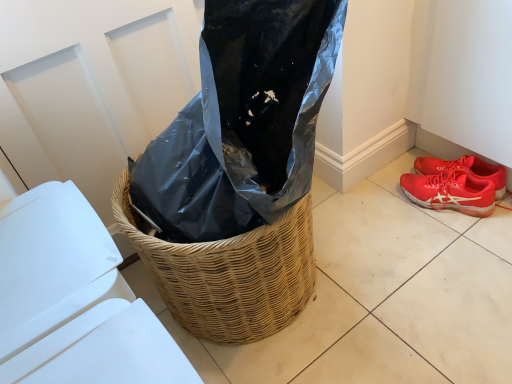
Question: Is shiny red sneakers at lower right, acting as the 2th footwear starting from the top, in front of or behind red mesh shoe at lower right, which is the 1th footwear in top-to-bottom order, in the image?

Choices:
 (A) behind
 (B) front

Answer: (B)

Question: Is shiny red sneakers at lower right, acting as the 2th footwear starting from the top, spatially inside red mesh shoe at lower right, the 2th footwear positioned from the bottom, or outside of it?

Choices:
 (A) outside
 (B) inside

Answer: (A)

Question: Which object is the closest to the white plastic lid at lower left?

Choices:
 (A) red mesh shoe at lower right, which is the 1th footwear in top-to-bottom order
 (B) shiny red sneakers at lower right, acting as the 2th footwear starting from the top

Answer: (B)

Question: Considering the real-world distances, which object is farthest from the red mesh shoe at lower right, the 2th footwear positioned from the bottom?

Choices:
 (A) shiny red sneakers at lower right, acting as the 2th footwear starting from the top
 (B) white plastic lid at lower left

Answer: (B)